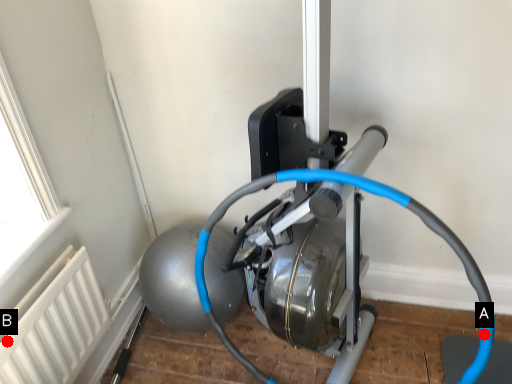
Question: Two points are circled on the image, labeled by A and B beside each circle. Which point appears closest to the camera in this image?

Choices:
 (A) A is closer
 (B) B is closer

Answer: (A)